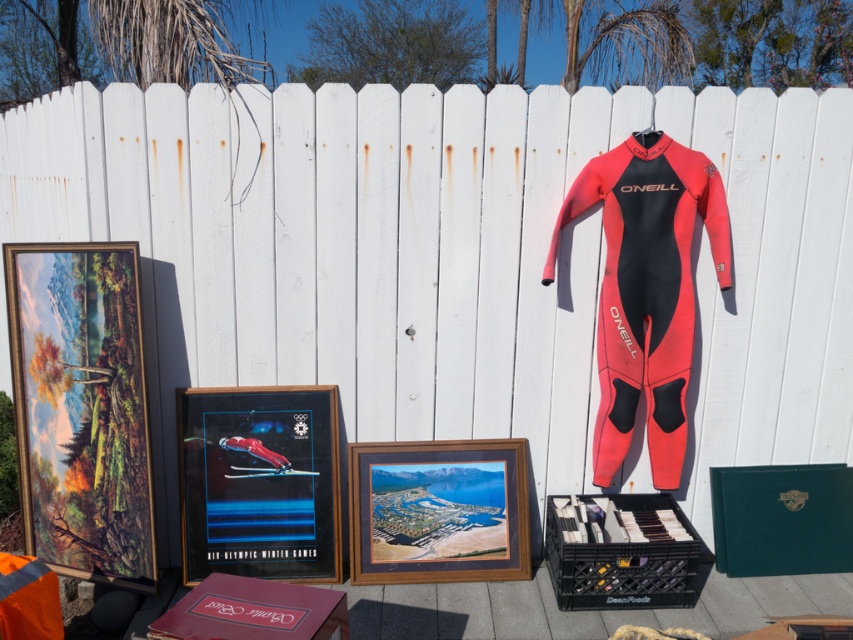
You are standing in the outdoor scene with the white picket fence. There is a point at coordinate (x=566, y=218). If you want to place a 10 feet long ladder from your current position to that point, will it fit without bending?

The distance between you and the point at (x=566, y=218) is 9.39 feet. Since the ladder is 10 feet long, it will extend beyond the required distance, so it can fit without bending.

You are a delivery person who needs to place a package between the red neoprene wetsuit at right and the wooden framed photo at center. The package is 24 inches long. Can you fit it between them without moving either object?

The red neoprene wetsuit at right is 25.93 inches away from the wooden framed photo at center, so yes, the package can fit between them since the distance is greater than the package length.